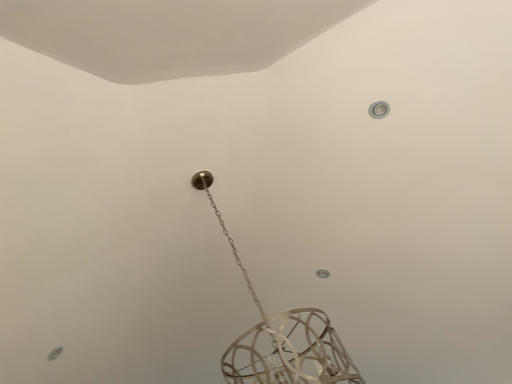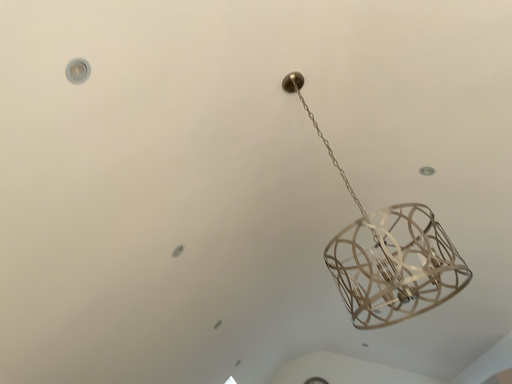
Question: Which way did the camera rotate in the video?

Choices:
 (A) rotated upward
 (B) rotated downward

Answer: (B)